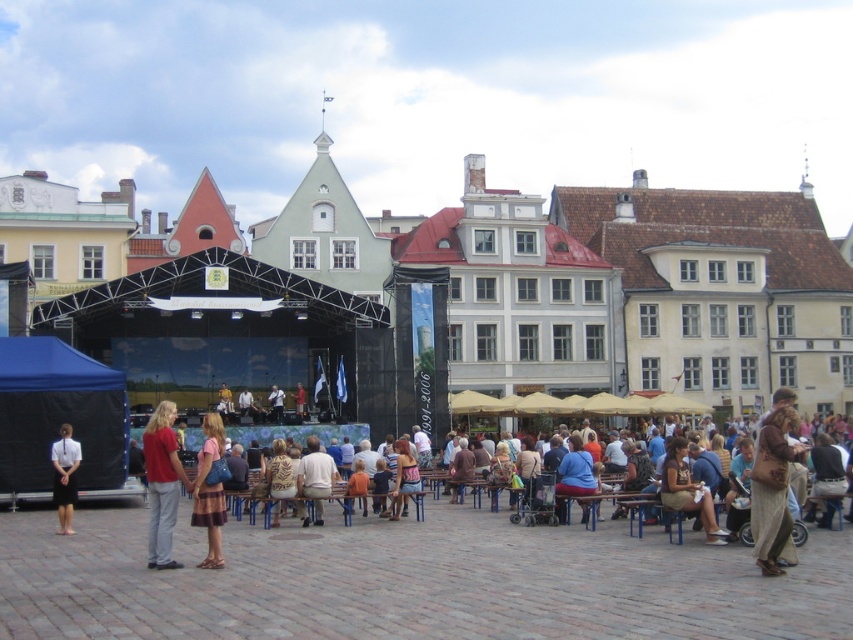
You are standing in the town square and want to take a photo of both the point at coordinates (x=747, y=356) and the point at coordinates (x=194, y=493). Which point should you focus on first to ensure both are in focus?

You should focus on the point at coordinates (x=747, y=356) first because it is closer to you than the other point, allowing both to be in focus when using depth of field.

Based on the photo, you are a photographer standing in the town square and see the brown leather bag at lower right. If you want to take a photo of the stage backdrop without the bag blocking the view, where should you move relative to the bag?

To avoid the brown leather bag at lower right blocking the view of the stage backdrop, move to the left or upward from the current position since the bag is positioned at point (x=688, y=490) in the image.